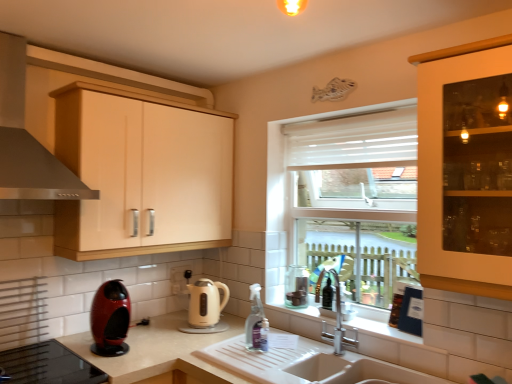
Where is `vacant space underneath beige glossy electric kettle at center (from a real-world perspective)`? This screenshot has width=512, height=384. vacant space underneath beige glossy electric kettle at center (from a real-world perspective) is located at coordinates (206, 326).